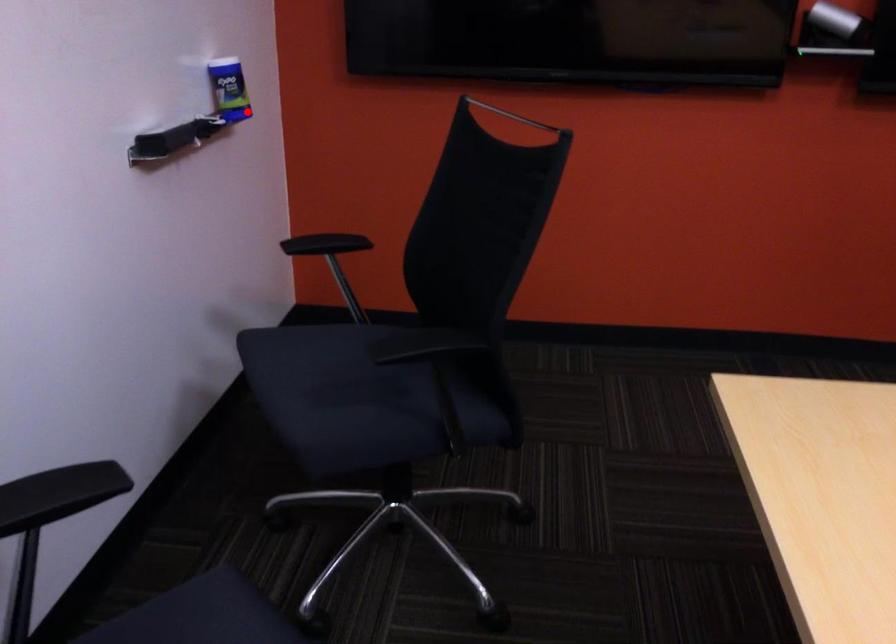
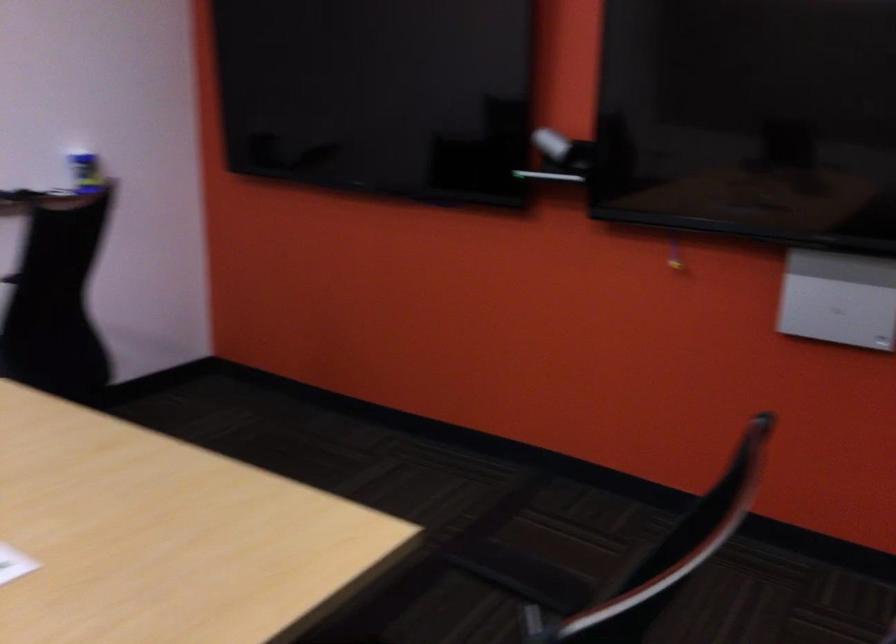
Question: I am providing you with two images of the same scene from different viewpoints. A red point is shown in image1. For the corresponding object point in image2, is it positioned nearer or farther from the camera?

Choices:
 (A) Nearer
 (B) Farther

Answer: (B)